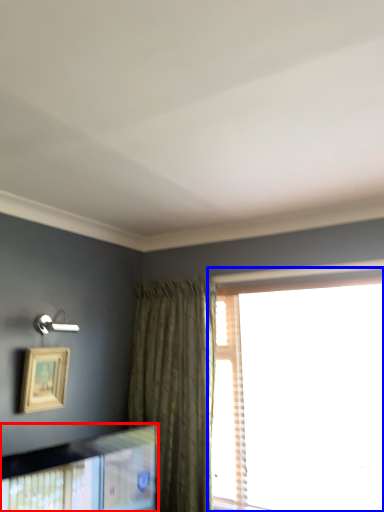
Question: Which object is closer to the camera taking this photo, picture frame (highlighted by a red box) or window (highlighted by a blue box)?

Choices:
 (A) picture frame
 (B) window

Answer: (A)